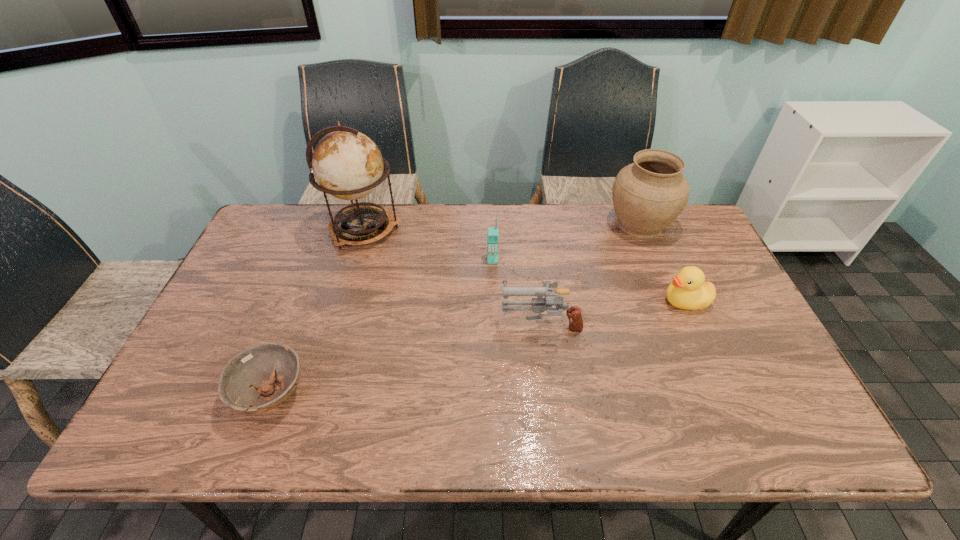
Select which object appears as the fifth closest to the duck. Please provide its 2D coordinates. Your answer should be formatted as a tuple, i.e. [(x, y)], where the tuple contains the x and y coordinates of a point satisfying the conditions above.

[(252, 372)]

Image resolution: width=960 pixels, height=540 pixels. Find the location of `object that is the second closest to the urn`. object that is the second closest to the urn is located at coordinates (539, 305).